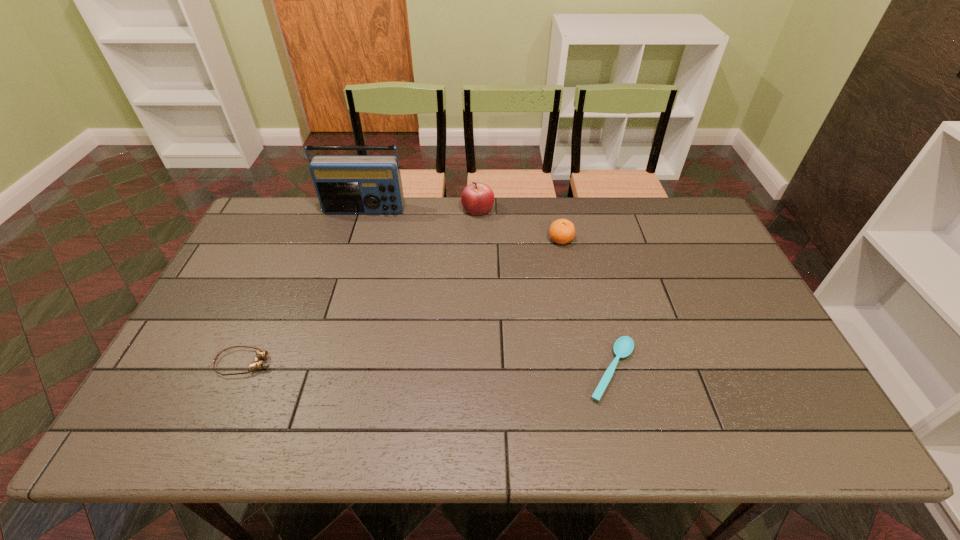
This screenshot has height=540, width=960. I want to click on vacant area that satisfies the following two spatial constraints: 1. on the front panel of the shortest object; 2. on the right side of the tallest object, so click(315, 370).

Locate an element on the screen. vacant space that satisfies the following two spatial constraints: 1. on the front panel of the tallest object; 2. on the left side of the clementine is located at coordinates (355, 239).

Find the location of `vacant space that satisfies the following two spatial constraints: 1. on the front side of the third tallest object; 2. on the left side of the fourth shortest object`. vacant space that satisfies the following two spatial constraints: 1. on the front side of the third tallest object; 2. on the left side of the fourth shortest object is located at coordinates (477, 239).